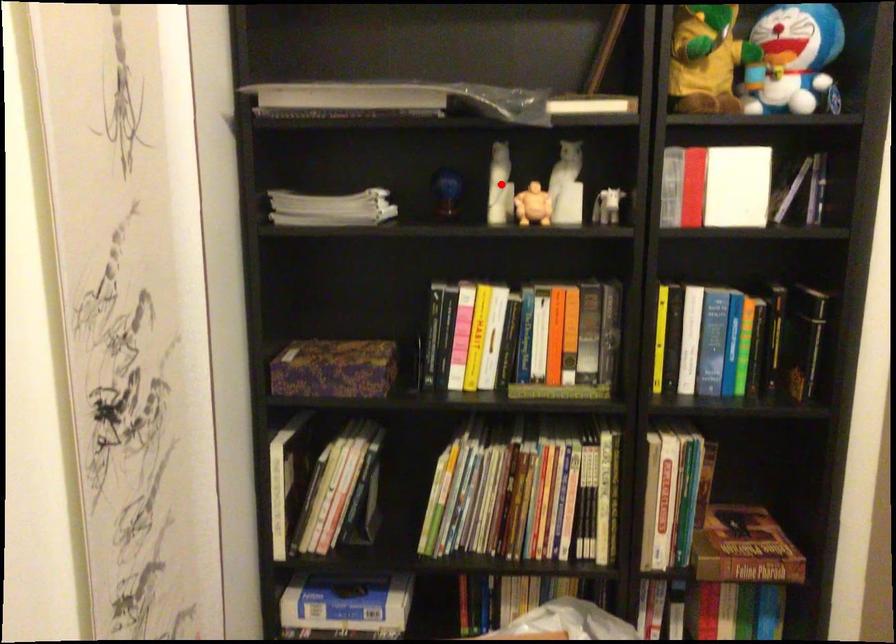
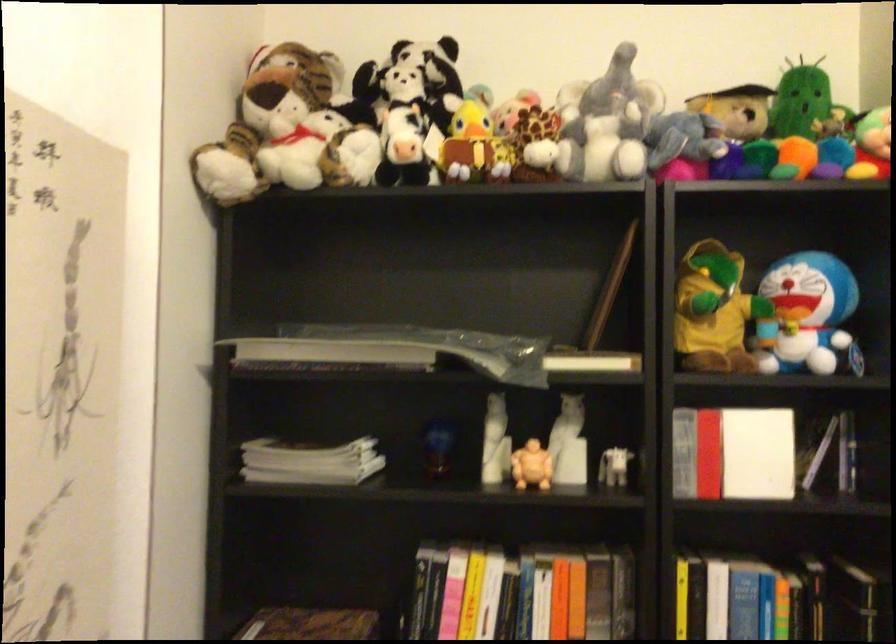
Question: I am providing you with two images of the same scene from different viewpoints. A red point is marked on the first image. At the location where the point appears in image 1, is it still visible in image 2?

Choices:
 (A) Yes
 (B) No

Answer: (A)